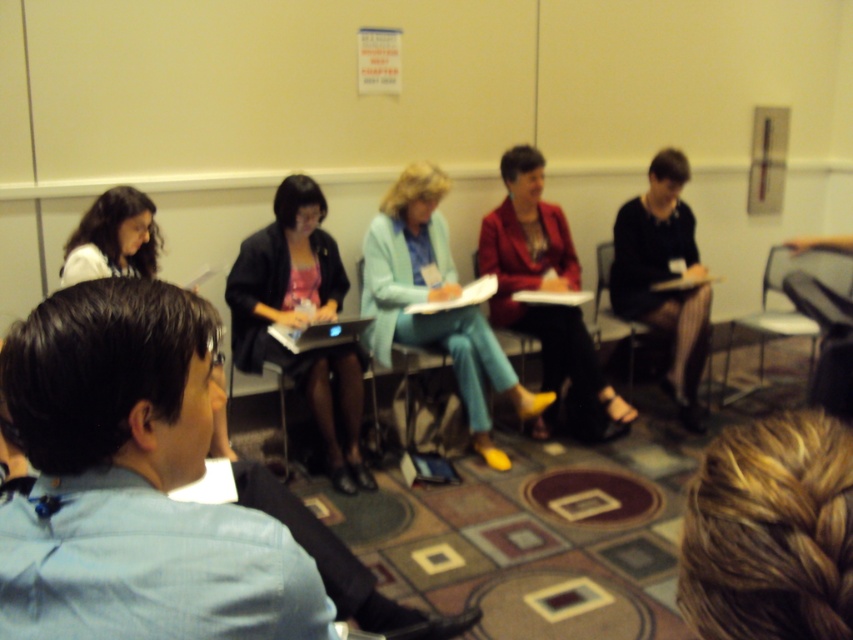
You are a photographer setting up for a group photo in the conference room. You notice the black fabric dress at right and the metallic silver chair at right. Which object takes up more space in the current frame?

The metallic silver chair at right takes up more space in the current frame than the black fabric dress at right.

You are an attendee in the conference room and want to see the presenter at the front. There are two objects in your view at the center of the image, the blonde braided hair at center and the light blue fabric jacket at center. Which object is closer to blocking your view?

The light blue fabric jacket at center is taller than the blonde braided hair at center, so the light blue fabric jacket at center is more likely to block your view.